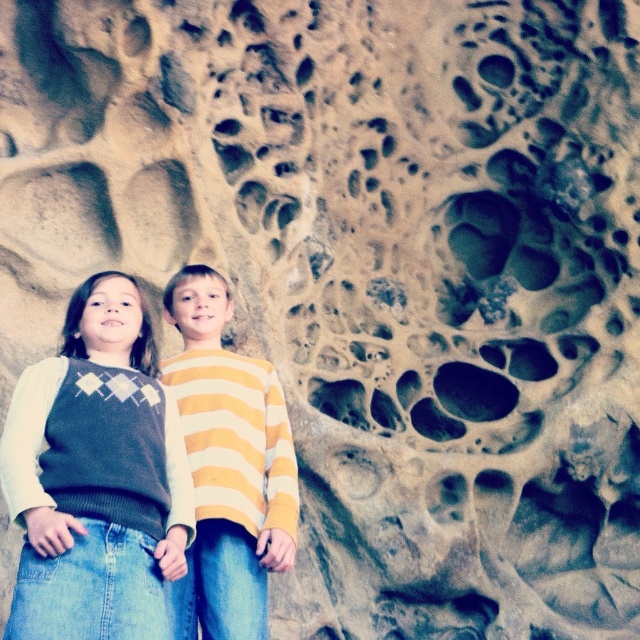
Does knit sweater at center have a greater width compared to yellow striped sweater at center?

Indeed, knit sweater at center has a greater width compared to yellow striped sweater at center.

Where is `knit sweater at center`? knit sweater at center is located at coordinates (97, 477).

This screenshot has width=640, height=640. What are the coordinates of `knit sweater at center` in the screenshot? It's located at (97, 477).